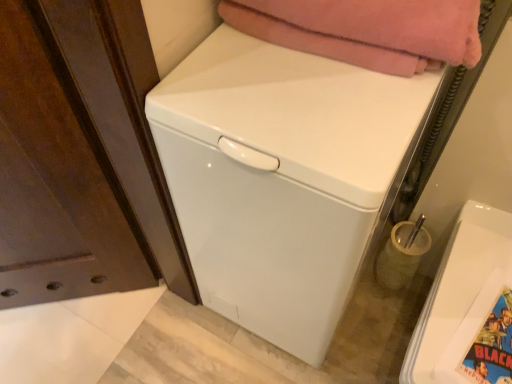
Question: Is colorful glossy comic book at lower right behind soft pink blanket at upper center?

Choices:
 (A) yes
 (B) no

Answer: (A)

Question: Is colorful glossy comic book at lower right placed right next to soft pink blanket at upper center?

Choices:
 (A) no
 (B) yes

Answer: (A)

Question: Is colorful glossy comic book at lower right surrounding soft pink blanket at upper center?

Choices:
 (A) yes
 (B) no

Answer: (B)

Question: From a real-world perspective, is colorful glossy comic book at lower right over soft pink blanket at upper center?

Choices:
 (A) no
 (B) yes

Answer: (A)

Question: Is colorful glossy comic book at lower right facing towards soft pink blanket at upper center?

Choices:
 (A) no
 (B) yes

Answer: (A)

Question: From a real-world perspective, is translucent glass toothbrush holder at lower right positioned above or below white glossy washing machine at center, positioned as the 2th washing machine in right-to-left order?

Choices:
 (A) below
 (B) above

Answer: (A)

Question: Considering the positions of translucent glass toothbrush holder at lower right and white glossy washing machine at center, the first washing machine from the left, in the image, is translucent glass toothbrush holder at lower right bigger or smaller than white glossy washing machine at center, the first washing machine from the left,?

Choices:
 (A) small
 (B) big

Answer: (A)

Question: In the image, is translucent glass toothbrush holder at lower right positioned in front of or behind white glossy washing machine at center, the first washing machine from the left?

Choices:
 (A) behind
 (B) front

Answer: (A)

Question: Is translucent glass toothbrush holder at lower right spatially inside white glossy washing machine at center, positioned as the 2th washing machine in right-to-left order, or outside of it?

Choices:
 (A) inside
 (B) outside

Answer: (B)

Question: Considering the positions of colorful glossy comic book at lower right and translucent glass toothbrush holder at lower right in the image, is colorful glossy comic book at lower right bigger or smaller than translucent glass toothbrush holder at lower right?

Choices:
 (A) small
 (B) big

Answer: (A)

Question: In terms of height, does colorful glossy comic book at lower right look taller or shorter compared to translucent glass toothbrush holder at lower right?

Choices:
 (A) short
 (B) tall

Answer: (A)

Question: Do you think colorful glossy comic book at lower right is within translucent glass toothbrush holder at lower right, or outside of it?

Choices:
 (A) inside
 (B) outside

Answer: (B)

Question: Visually, is colorful glossy comic book at lower right positioned to the left or to the right of translucent glass toothbrush holder at lower right?

Choices:
 (A) right
 (B) left

Answer: (A)

Question: Is white glossy washing machine at center, positioned as the 2th washing machine in right-to-left order, taller or shorter than soft pink blanket at upper center?

Choices:
 (A) short
 (B) tall

Answer: (B)

Question: From a real-world perspective, is white glossy washing machine at center, positioned as the 2th washing machine in right-to-left order, above or below soft pink blanket at upper center?

Choices:
 (A) above
 (B) below

Answer: (B)